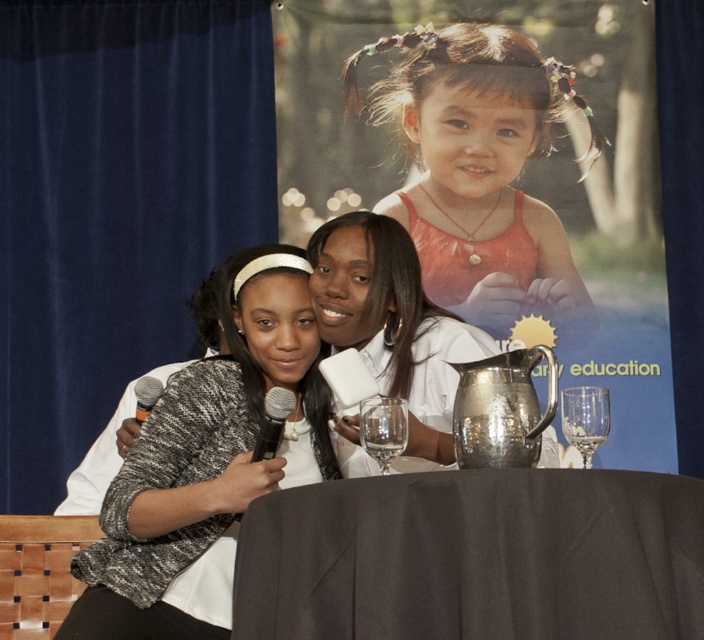
You are a waiter at the event and need to serve a guest who prefers a larger drink. Which glass should you choose between the transparent glass at lower right and the transparent glass wine glass at center?

The transparent glass at lower right is larger in size than the transparent glass wine glass at center, so you should choose the transparent glass at lower right to serve the guest who prefers a larger drink.

You are attending a formal event and need to place a small name tag on either the black fabric table at center or the matte orange dress at center. Which object should you choose if you want the name tag to be placed higher?

The matte orange dress at center is taller than the black fabric table at center, so placing the name tag on the matte orange dress at center would result in a higher placement.